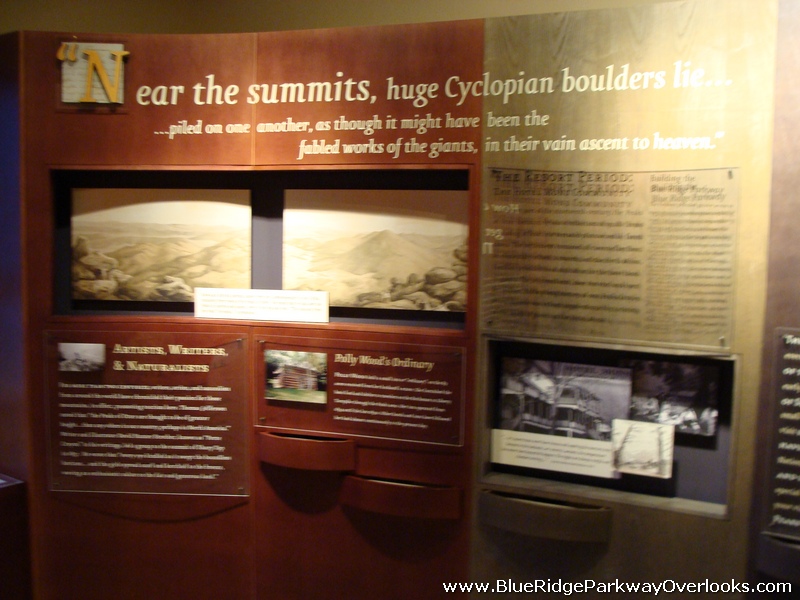
The height and width of the screenshot is (600, 800). I want to click on display of pictures 7, so click(x=170, y=226), click(x=406, y=235), click(x=82, y=362), click(x=304, y=373), click(x=550, y=406), click(x=686, y=395), click(x=642, y=479).